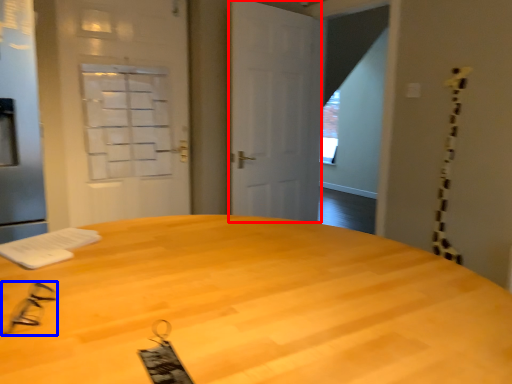
Question: Among these objects, which one is nearest to the camera, door (highlighted by a red box) or glasses (highlighted by a blue box)?

Choices:
 (A) door
 (B) glasses

Answer: (B)